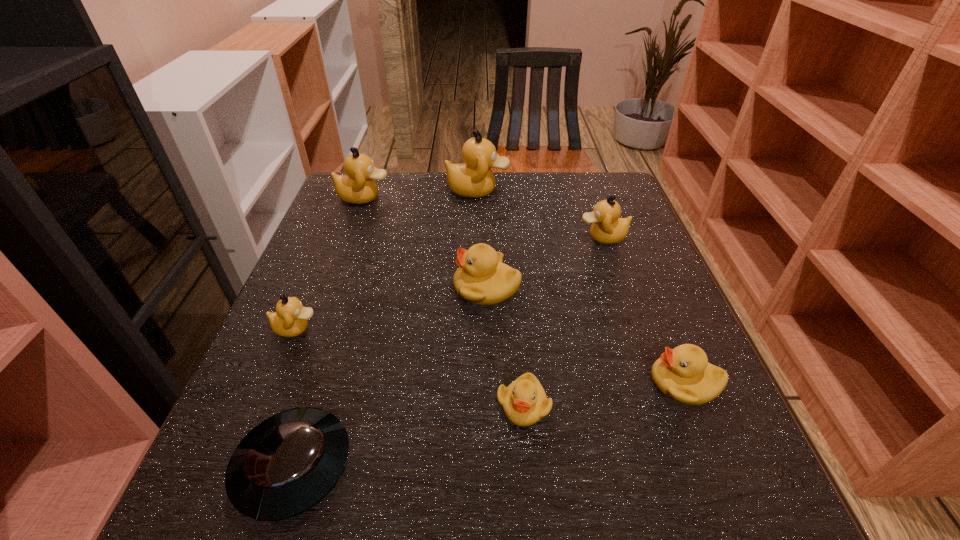
I want to click on duckling that is the fourth closest one to the rightmost tan duckling, so click(524, 401).

Choose which tan duckling is the nearest neighbor to the fourth nearest duckling. Please provide its 2D coordinates. Your answer should be formatted as a tuple, i.e. [(x, y)], where the tuple contains the x and y coordinates of a point satisfying the conditions above.

[(607, 228)]

Select which tan duckling is the second closest to the rightmost yellow duckling. Please provide its 2D coordinates. Your answer should be formatted as a tuple, i.e. [(x, y)], where the tuple contains the x and y coordinates of a point satisfying the conditions above.

[(474, 178)]

Select which yellow duckling appears as the third closest to the saucer. Please provide its 2D coordinates. Your answer should be formatted as a tuple, i.e. [(x, y)], where the tuple contains the x and y coordinates of a point satisfying the conditions above.

[(683, 374)]

Identify which yellow duckling is located as the third nearest to the second biggest tan duckling. Please provide its 2D coordinates. Your answer should be formatted as a tuple, i.e. [(x, y)], where the tuple contains the x and y coordinates of a point satisfying the conditions above.

[(683, 374)]